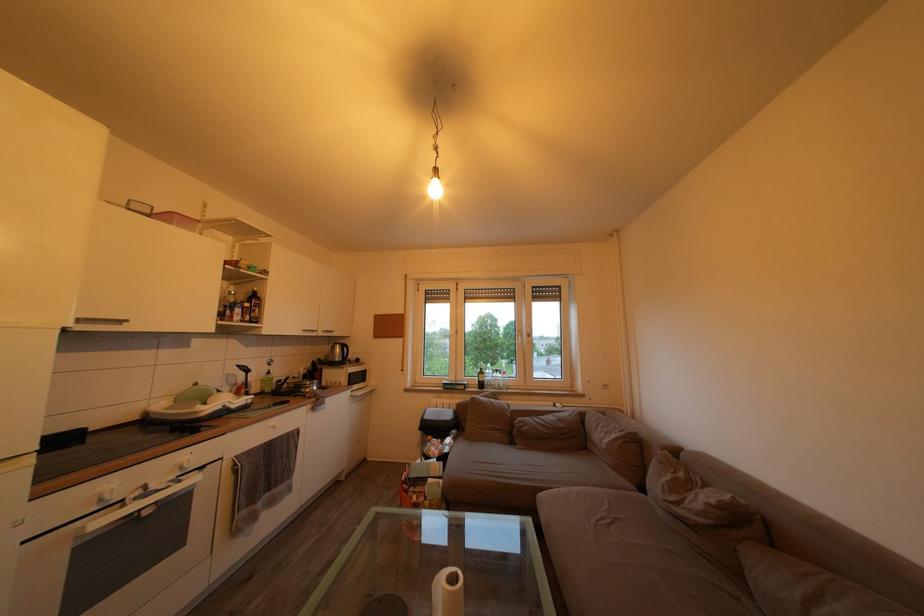
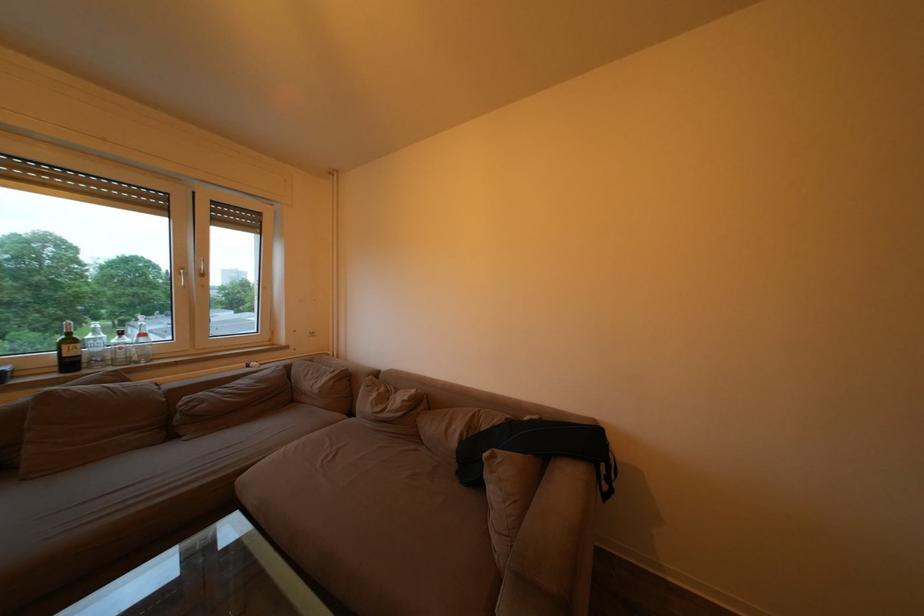
Locate, in the second image, the point that corresponds to the point at 505,377 in the first image.

(129, 339)